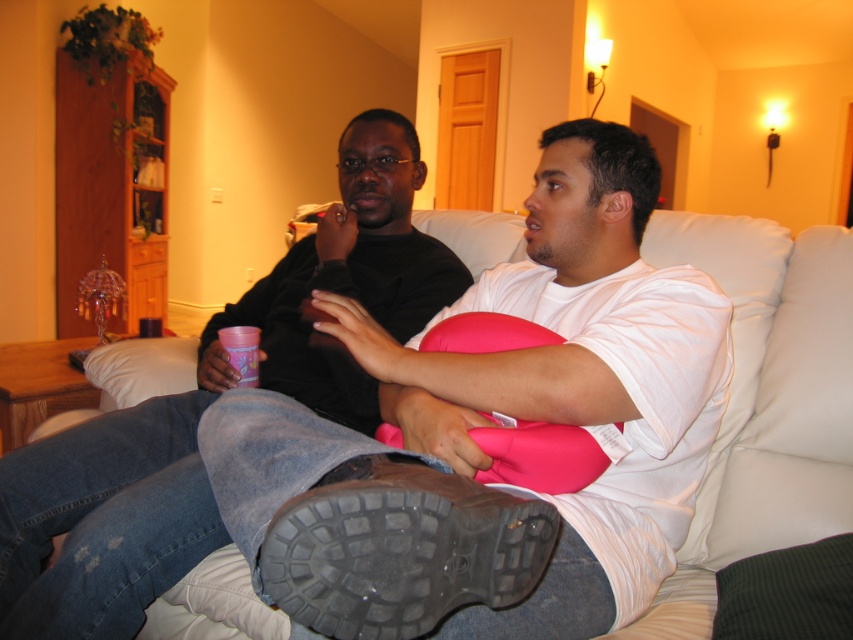
You are designing a new living room layout and want to ensure that the matte black shirt at center and the white leather couch at center are visible from the entrance. Given their sizes, which object should be placed closer to the entrance to ensure visibility?

The matte black shirt at center is larger than the white leather couch at center, so placing it closer to the entrance would ensure better visibility.

What is located at the coordinates point (210, 403) in the image?

The coordinates point (210, 403) indicate the location of the matte black shirt at center.

You are a delivery robot with a box that is 25 inches wide. You need to place it between the matte black shirt at center and the white leather couch at center. Is there enough space?

The distance between the matte black shirt at center and the white leather couch at center is 25.03 inches. Since the box is 25 inches wide, there is just enough space to place it between them.